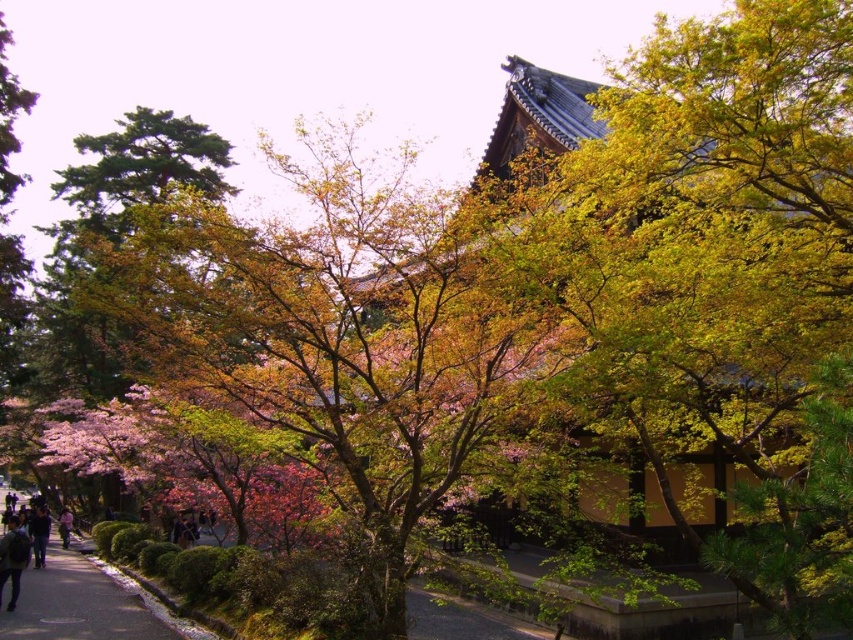
Can you confirm if dark blue backpack at lower left is smaller than pink fabric at lower left?

No.

How much distance is there between dark blue backpack at lower left and pink fabric at lower left?

dark blue backpack at lower left is 14.25 meters from pink fabric at lower left.

Which is behind, point (16, 580) or point (65, 515)?

Positioned behind is point (65, 515).

You are a GUI agent. You are given a task and a screenshot of the screen. Output one action in this format:
    pyautogui.click(x=<x>, y=<y>)
    Task: Click on the dark blue backpack at lower left
    The height and width of the screenshot is (640, 853).
    Given the screenshot: What is the action you would take?
    pyautogui.click(x=13, y=557)

Can you confirm if dark blue backpack at lower left is taller than dark blue jeans at lower left?

Yes, dark blue backpack at lower left is taller than dark blue jeans at lower left.

Does dark blue backpack at lower left appear under dark blue jeans at lower left?

No.

What do you see at coordinates (13, 557) in the screenshot? I see `dark blue backpack at lower left` at bounding box center [13, 557].

Where is `dark blue backpack at lower left`? The width and height of the screenshot is (853, 640). dark blue backpack at lower left is located at coordinates (13, 557).

Image resolution: width=853 pixels, height=640 pixels. What do you see at coordinates (76, 604) in the screenshot? I see `paved asphalt sidewalk at lower left` at bounding box center [76, 604].

Does paved asphalt sidewalk at lower left have a greater width compared to dark blue backpack at lower left?

Correct, the width of paved asphalt sidewalk at lower left exceeds that of dark blue backpack at lower left.

The image size is (853, 640). Describe the element at coordinates (76, 604) in the screenshot. I see `paved asphalt sidewalk at lower left` at that location.

At what (x,y) coordinates should I click in order to perform the action: click on paved asphalt sidewalk at lower left. Please return your answer as a coordinate pair (x, y). Looking at the image, I should click on coord(76,604).